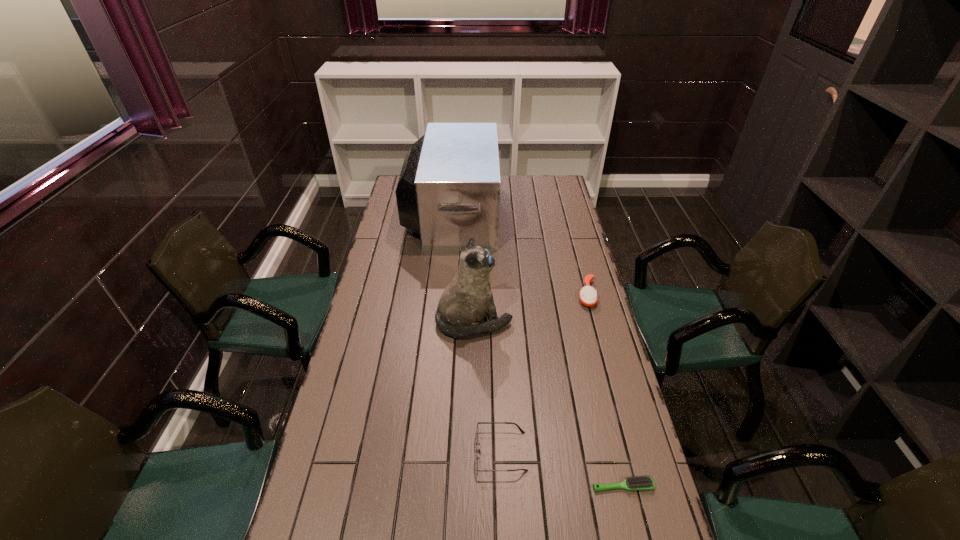
Locate an element on the screen. The image size is (960, 540). the farthest object is located at coordinates (448, 191).

This screenshot has height=540, width=960. Find the location of `cat`. cat is located at coordinates (467, 299).

The width and height of the screenshot is (960, 540). Identify the location of the third shortest object. (588, 297).

Identify the location of the taller hairbrush. Image resolution: width=960 pixels, height=540 pixels. (588, 297).

Where is `the second nearest object`? The image size is (960, 540). the second nearest object is located at coordinates (476, 433).

Image resolution: width=960 pixels, height=540 pixels. Find the location of `the shortest object`. the shortest object is located at coordinates (643, 482).

The image size is (960, 540). I want to click on the nearer hairbrush, so click(643, 482).

Where is `vacant space located 0.230m on the front-facing side of the microwave oven`? vacant space located 0.230m on the front-facing side of the microwave oven is located at coordinates (544, 213).

This screenshot has height=540, width=960. Identify the location of free spot located 0.270m at the face of the cat. (588, 321).

Find the location of `vacant region located on the back of the taller hairbrush`. vacant region located on the back of the taller hairbrush is located at coordinates (579, 266).